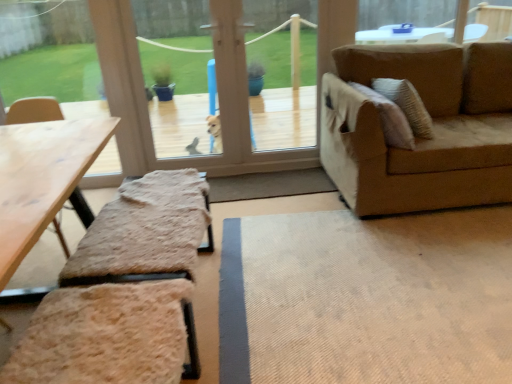
Question: From the image's perspective, is wooden picnic table at lower left above transparent plastic dog at center?

Choices:
 (A) yes
 (B) no

Answer: (B)

Question: From a real-world perspective, is wooden picnic table at lower left located higher than transparent plastic dog at center?

Choices:
 (A) no
 (B) yes

Answer: (A)

Question: Does wooden picnic table at lower left have a greater width compared to transparent plastic dog at center?

Choices:
 (A) yes
 (B) no

Answer: (A)

Question: Is wooden picnic table at lower left positioned far away from transparent plastic dog at center?

Choices:
 (A) no
 (B) yes

Answer: (B)

Question: Can you confirm if wooden picnic table at lower left is smaller than transparent plastic dog at center?

Choices:
 (A) no
 (B) yes

Answer: (A)

Question: Can you confirm if wooden picnic table at lower left is thinner than transparent plastic dog at center?

Choices:
 (A) yes
 (B) no

Answer: (B)

Question: Does transparent plastic dog at center contain wooden picnic table at lower left?

Choices:
 (A) yes
 (B) no

Answer: (B)

Question: Considering the relative sizes of transparent plastic dog at center and wooden picnic table at lower left in the image provided, is transparent plastic dog at center shorter than wooden picnic table at lower left?

Choices:
 (A) no
 (B) yes

Answer: (A)

Question: Is transparent plastic dog at center outside wooden picnic table at lower left?

Choices:
 (A) no
 (B) yes

Answer: (B)

Question: Is transparent plastic dog at center turned away from wooden picnic table at lower left?

Choices:
 (A) yes
 (B) no

Answer: (B)

Question: From a real-world perspective, is transparent plastic dog at center positioned over wooden picnic table at lower left based on gravity?

Choices:
 (A) no
 (B) yes

Answer: (B)

Question: From the image's perspective, is transparent plastic dog at center over wooden picnic table at lower left?

Choices:
 (A) yes
 (B) no

Answer: (A)

Question: From the image's perspective, is transparent plastic dog at center positioned above or below wooden picnic table at lower left?

Choices:
 (A) above
 (B) below

Answer: (A)